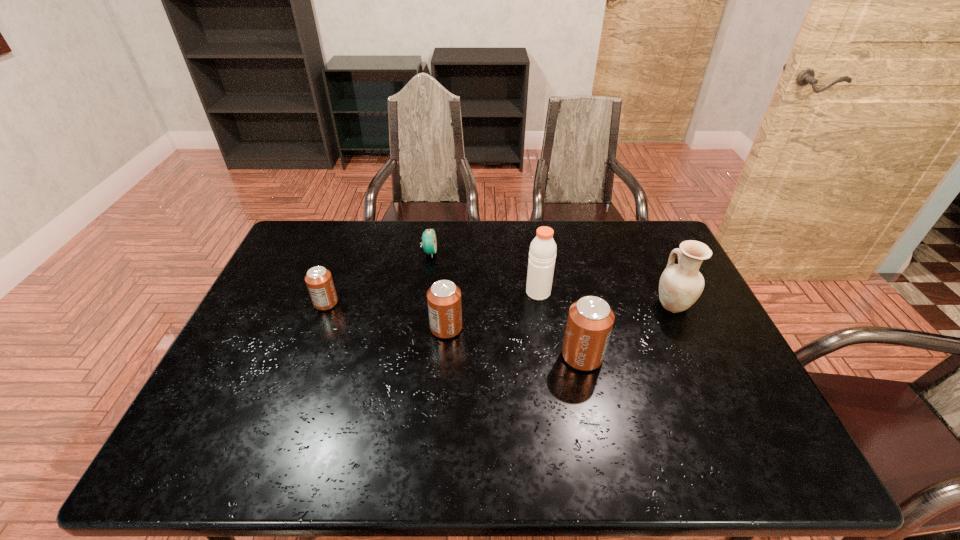
Locate an element on the screen. The image size is (960, 540). the farthest can is located at coordinates (319, 281).

Locate an element on the screen. The height and width of the screenshot is (540, 960). the fifth tallest object is located at coordinates (319, 281).

The width and height of the screenshot is (960, 540). In order to click on the third shortest object in this screenshot , I will do `click(444, 303)`.

Find the location of a particular element. This screenshot has width=960, height=540. the second can from right to left is located at coordinates (444, 303).

Where is `the fourth shortest object`? the fourth shortest object is located at coordinates (590, 320).

This screenshot has height=540, width=960. Identify the location of the nearest object. (590, 320).

You are a GUI agent. You are given a task and a screenshot of the screen. Output one action in this format:
    pyautogui.click(x=<x>, y=<y>)
    Task: Click on the shortest object
    The height and width of the screenshot is (540, 960).
    Given the screenshot: What is the action you would take?
    pyautogui.click(x=429, y=241)

The width and height of the screenshot is (960, 540). Find the location of `the second object from left to right`. the second object from left to right is located at coordinates (429, 241).

Where is `the rightmost object`? This screenshot has height=540, width=960. the rightmost object is located at coordinates (680, 285).

Identify the location of shaker. (542, 254).